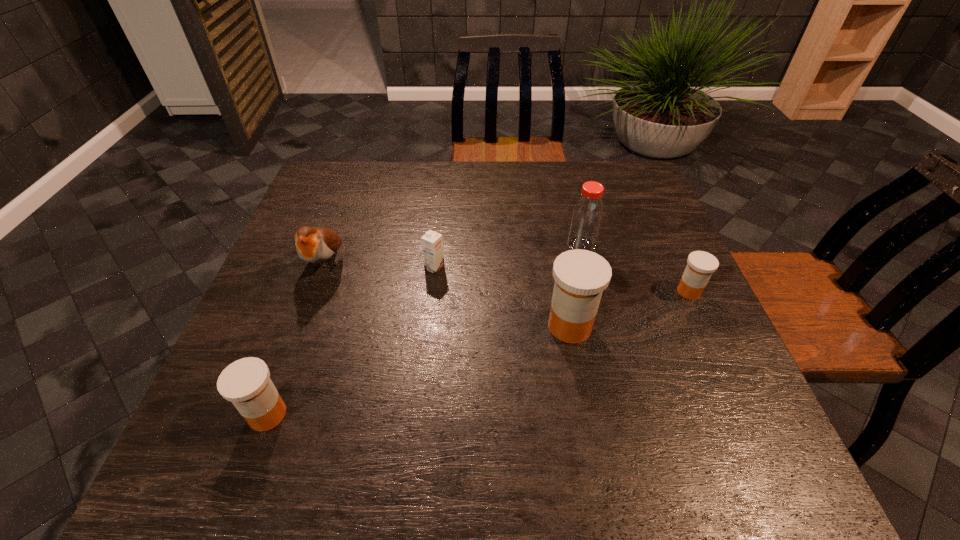
Image resolution: width=960 pixels, height=540 pixels. Identify the location of the nearest medicine. (246, 383).

In order to click on the leftmost medicine in this screenshot , I will do `click(246, 383)`.

Image resolution: width=960 pixels, height=540 pixels. Find the location of `the fifth farthest object`. the fifth farthest object is located at coordinates (581, 276).

What are the coordinates of `the second farthest medicine` in the screenshot? It's located at (581, 276).

You are a GUI agent. You are given a task and a screenshot of the screen. Output one action in this format:
    pyautogui.click(x=<x>, y=<y>)
    Task: Click on the shortest medicine
    The image size is (960, 540).
    Given the screenshot: What is the action you would take?
    (701, 265)

The image size is (960, 540). In order to click on the rightmost object in this screenshot , I will do `click(701, 265)`.

Find the location of a particular element. The image size is (960, 540). chocolate milk is located at coordinates (432, 242).

Where is `bird`? bird is located at coordinates (316, 245).

Locate an element on the screen. Image resolution: width=960 pixels, height=540 pixels. bottle is located at coordinates (587, 214).

Identify the location of vacant space located on the label of the tallest medicine. (393, 326).